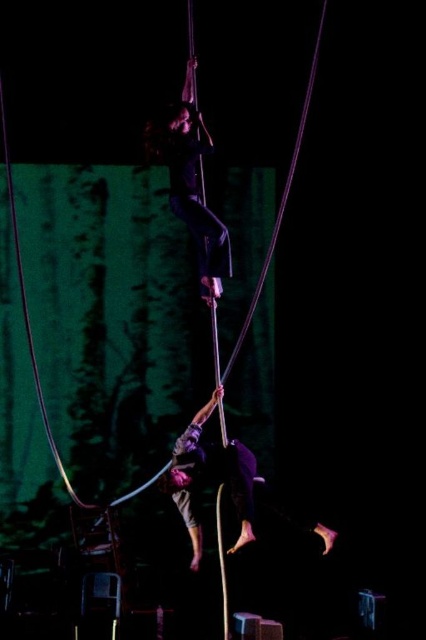
Who is higher up, black matte pants at upper center or smooth blue rope at upper center?

black matte pants at upper center is above.

Does black matte pants at upper center appear on the left side of smooth blue rope at upper center?

In fact, black matte pants at upper center is to the right of smooth blue rope at upper center.

At what (x,y) coordinates should I click in order to perform the action: click on black matte pants at upper center. Please return your answer as a coordinate pair (x, y). This screenshot has width=426, height=640. Looking at the image, I should click on (189, 182).

At what (x,y) coordinates should I click in order to perform the action: click on black matte pants at upper center. Please return your answer as a coordinate pair (x, y). The width and height of the screenshot is (426, 640). Looking at the image, I should click on (189, 182).

Which is above, black matte pants at upper center or dark purple fabric pole at lower center?

black matte pants at upper center is higher up.

Does black matte pants at upper center come in front of dark purple fabric pole at lower center?

Yes, it is in front of dark purple fabric pole at lower center.

Is point (186, 154) closer to camera compared to point (192, 419)?

Yes, it is in front of point (192, 419).

At what (x,y) coordinates should I click in order to perform the action: click on black matte pants at upper center. Please return your answer as a coordinate pair (x, y). This screenshot has height=640, width=426. Looking at the image, I should click on (189, 182).

Which is behind, point (241, 516) or point (204, 180)?

The point (204, 180) is behind.

Does dark purple fabric pole at lower center have a larger size compared to smooth blue rope at upper center?

Correct, dark purple fabric pole at lower center is larger in size than smooth blue rope at upper center.

Does point (253, 508) come in front of point (11, 227)?

Yes, it is.

Locate an element on the screen. The width and height of the screenshot is (426, 640). dark purple fabric pole at lower center is located at coordinates (213, 474).